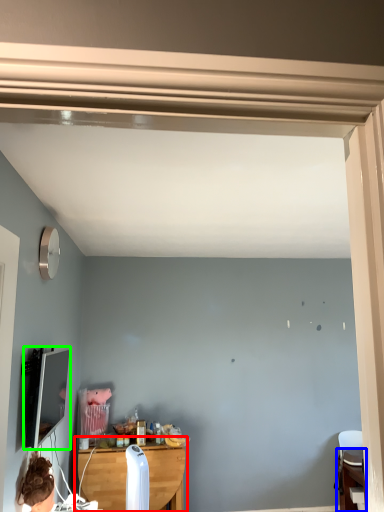
Question: Which object is positioned closest to table (highlighted by a red box)? Select from table (highlighted by a blue box) and computer monitor (highlighted by a green box).

Choices:
 (A) table
 (B) computer monitor

Answer: (B)